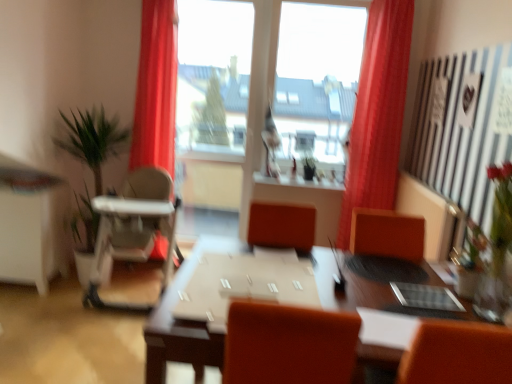
Where is `free spot in front of green leafy plant at left`? This screenshot has height=384, width=512. free spot in front of green leafy plant at left is located at coordinates (55, 312).